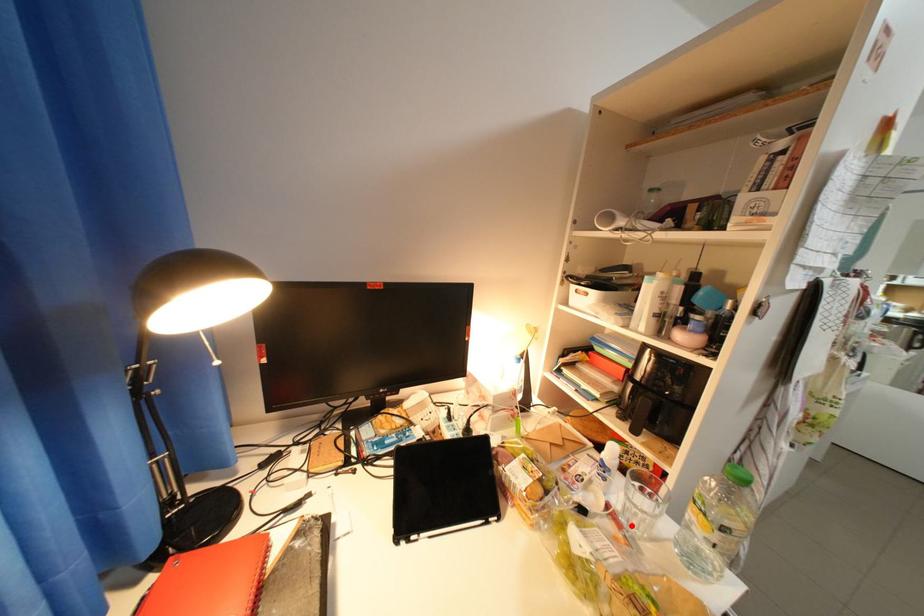
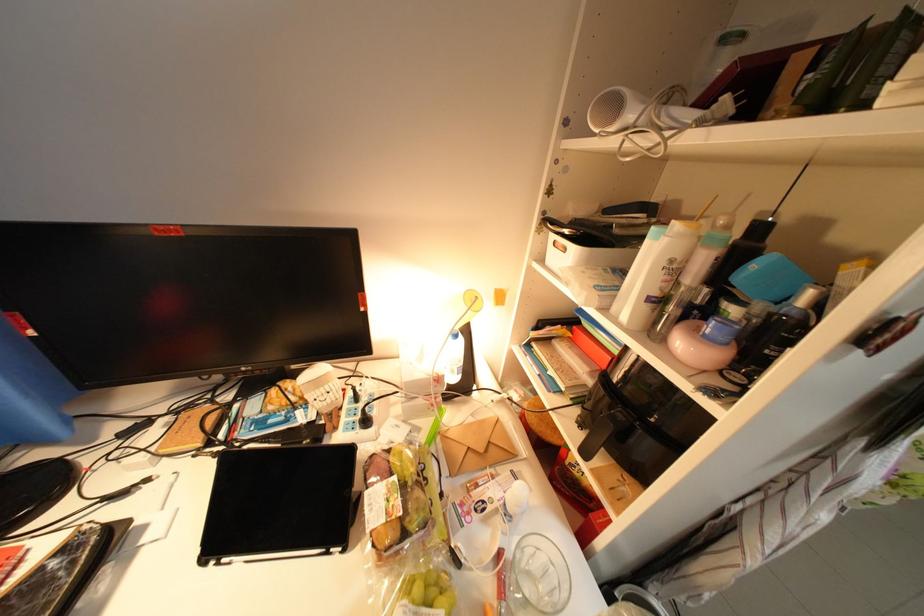
Question: I am providing you with two images of the same scene from different viewpoints. A red point is marked on the first image. Can you still see the location of the red point in image 2?

Choices:
 (A) Yes
 (B) No

Answer: (A)